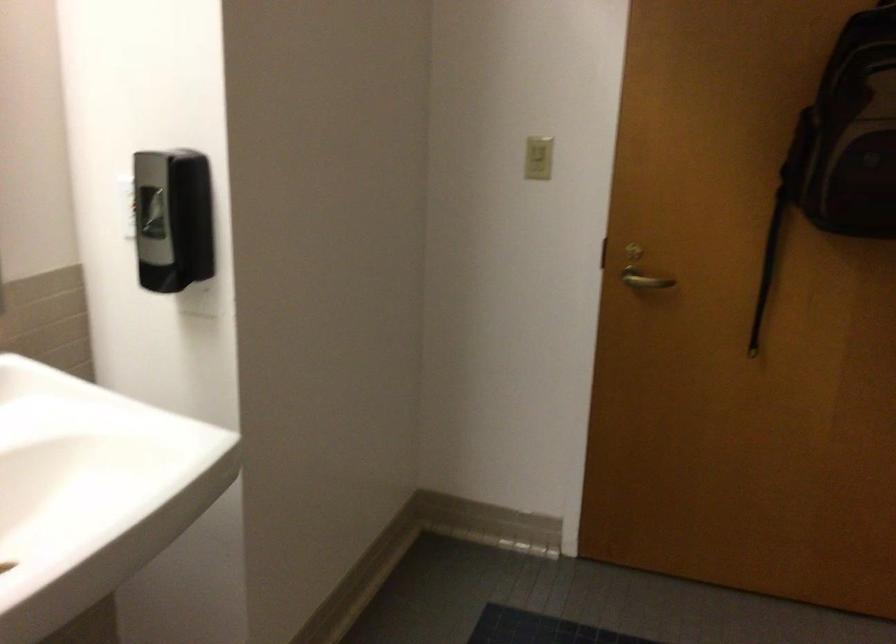
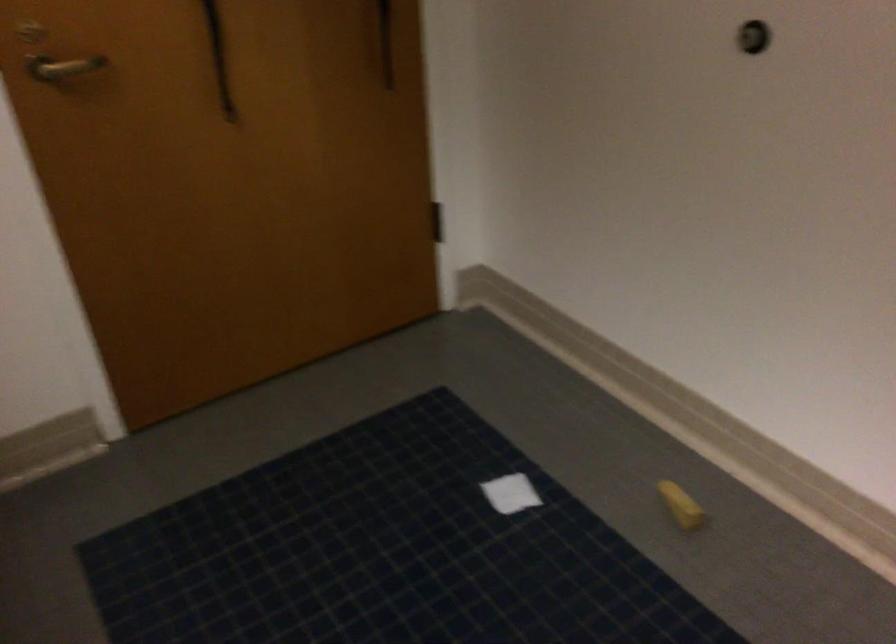
Where in the second image is the point corresponding to (x=756, y=305) from the first image?

(219, 58)